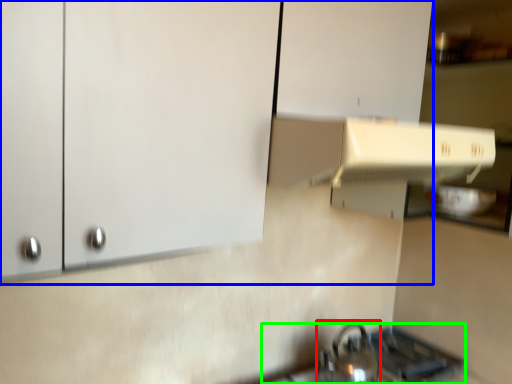
Question: Considering the real-world distances, which object is closest to tea pot (highlighted by a red box)? cabinetry (highlighted by a blue box) or gas stove (highlighted by a green box).

Choices:
 (A) cabinetry
 (B) gas stove

Answer: (B)